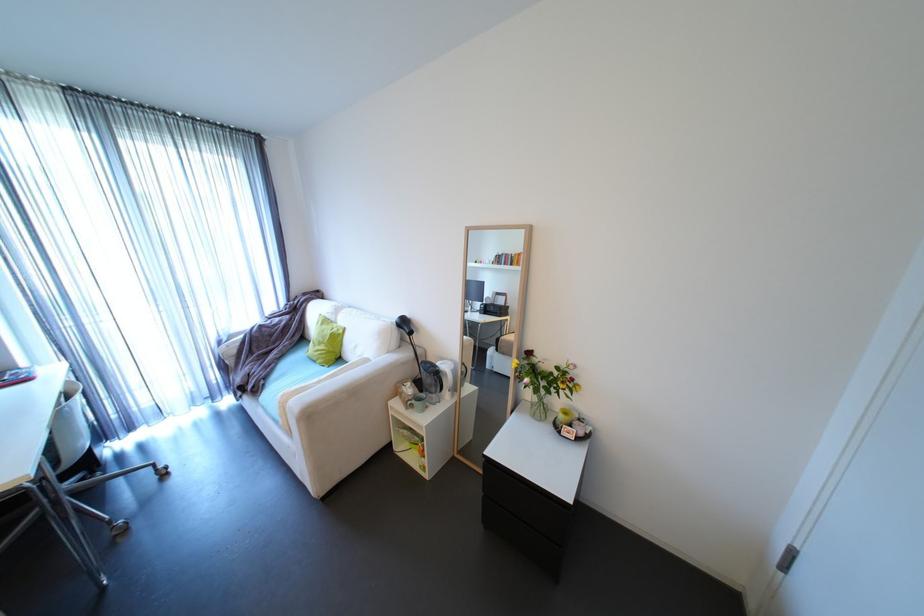
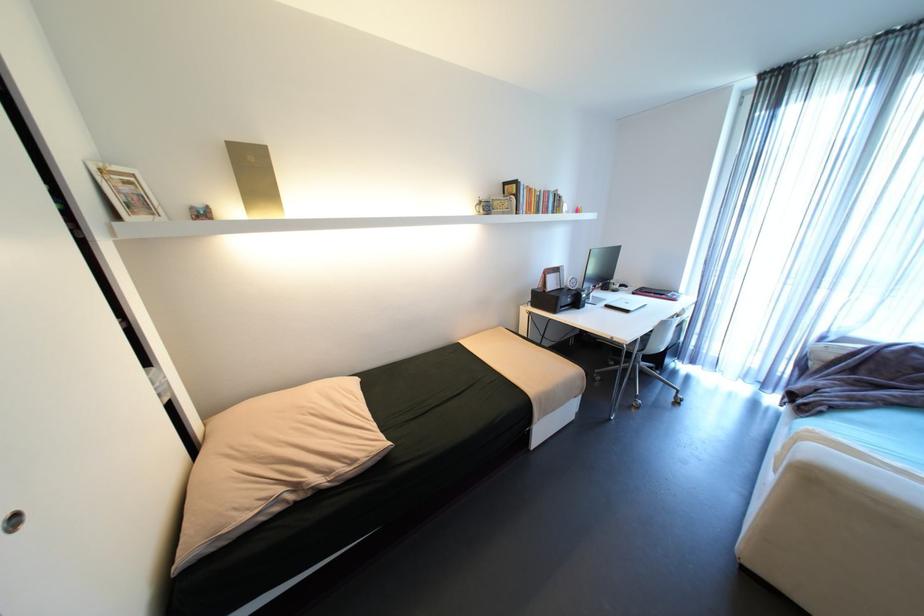
First-person continuous shooting, in which direction is the camera rotating?

The rotation direction of the camera is left-down.